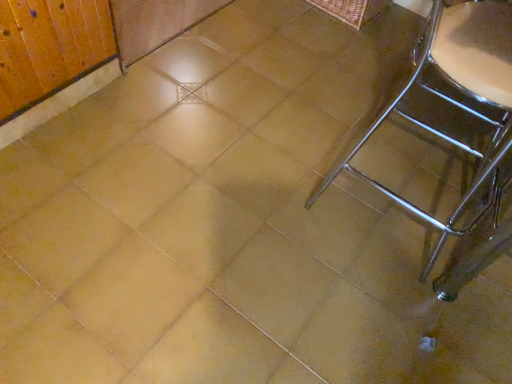
The height and width of the screenshot is (384, 512). What are the coordinates of `vacant space that's between polished chrome chair at right and woven brown basket at upper right` in the screenshot? It's located at (349, 82).